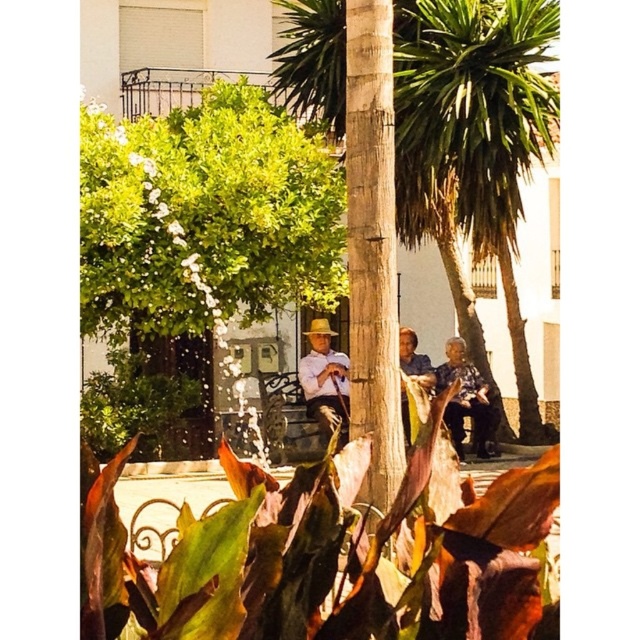
You are a photographer trying to capture a clear shot of the dark blue fabric shirt at center and the light brown straw hat at center. Since the foreground leaves are slightly out of focus, which object should you focus on to ensure it appears sharp in the photo?

The dark blue fabric shirt at center is closer to the viewer than the light brown straw hat at center, so focusing on it will ensure it appears sharp while the hat may still be in focus depending on depth of field. Alternatively, focusing between them might achieve both.

You are a photographer trying to capture a photo of the blue fabric shirt at center without including the green leafy tree at upper left in the frame. Is this possible based on their positions?

The green leafy tree at upper left is above the blue fabric shirt at center, so it would be difficult to capture the blue fabric shirt at center without including the tree in the frame unless you adjust your angle or crop the image.

You are a photographer trying to capture the scene with a focus on the dark blue fabric shirt at center and the light brown straw hat at center. Which object should you adjust your camera focus to first if you want both to be in sharp focus?

The dark blue fabric shirt at center is positioned under light brown straw hat at center, so you should focus on the light brown straw hat at center first since it is farther away and adjusting focus there will help both objects be in sharp focus.